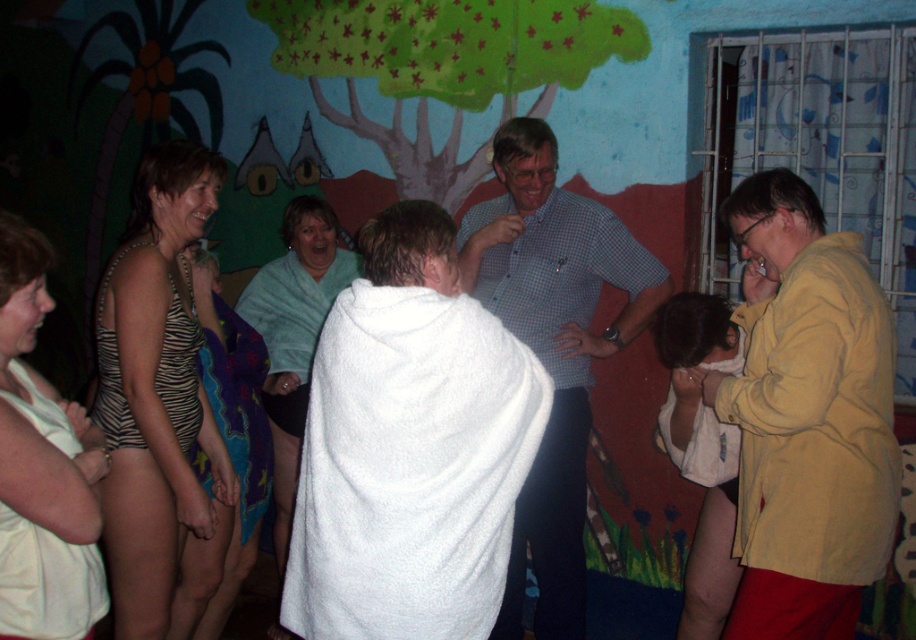
Question: Can you confirm if yellow matte jacket at right is positioned to the left of white fabric at left?

Choices:
 (A) no
 (B) yes

Answer: (A)

Question: Which point is closer to the camera?

Choices:
 (A) (151, 198)
 (B) (559, 355)
 (C) (262, 276)
 (D) (41, 275)

Answer: (D)

Question: Which point is closer to the camera?

Choices:
 (A) [845, 292]
 (B) [303, 380]
 (C) [478, 211]

Answer: (A)

Question: Is zebra print swimsuit at left below white fabric at left?

Choices:
 (A) no
 (B) yes

Answer: (A)

Question: Which point appears farthest from the camera in this image?

Choices:
 (A) (769, 324)
 (B) (112, 332)

Answer: (B)

Question: Considering the relative positions of yellow matte jacket at right and zebra print swimsuit at left in the image provided, where is yellow matte jacket at right located with respect to zebra print swimsuit at left?

Choices:
 (A) above
 (B) below

Answer: (B)